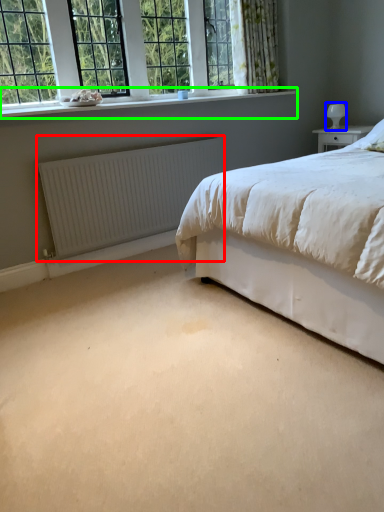
Question: Which is nearer to the radiator (highlighted by a red box)? table lamp (highlighted by a blue box) or window sill (highlighted by a green box).

Choices:
 (A) table lamp
 (B) window sill

Answer: (B)